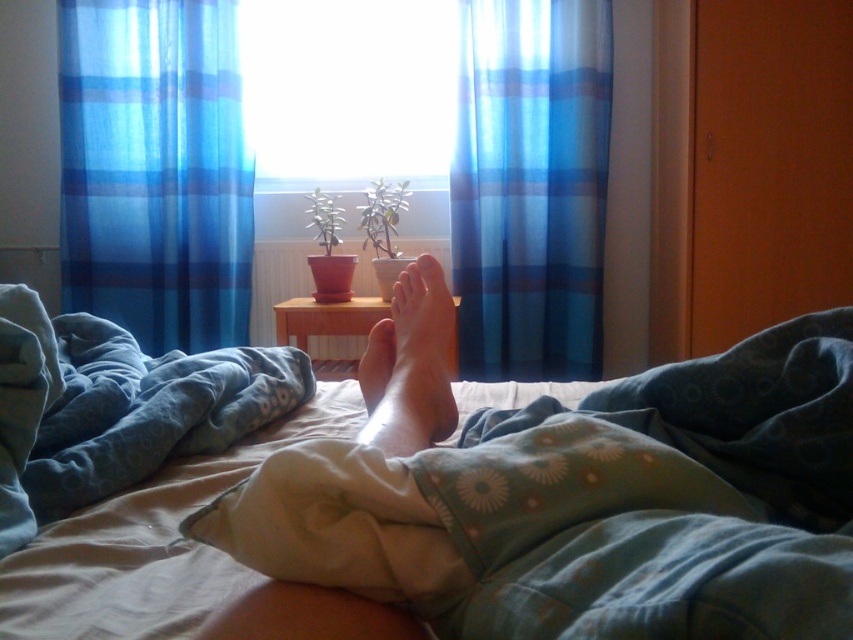
Question: Which object is positioned closest to the blue plaid curtain at upper center?

Choices:
 (A) smooth skin foot at center
 (B) blue sheer curtain at left
 (C) blue soft blanket at lower center
 (D) soft cotton bed at center

Answer: (B)

Question: Among these points, which one is nearest to the camera?

Choices:
 (A) (419, 378)
 (B) (15, 525)

Answer: (B)

Question: Considering the real-world distances, which object is closest to the smooth skin foot at center?

Choices:
 (A) soft cotton bed at center
 (B) transparent glass window at center

Answer: (A)

Question: Does blue sheer curtain at left come in front of smooth skin foot at center?

Choices:
 (A) yes
 (B) no

Answer: (B)

Question: Is soft cotton bed at center positioned behind transparent glass window at center?

Choices:
 (A) no
 (B) yes

Answer: (A)

Question: Considering the relative positions of soft cotton bed at center and smooth skin foot at center in the image provided, where is soft cotton bed at center located with respect to smooth skin foot at center?

Choices:
 (A) right
 (B) left

Answer: (B)